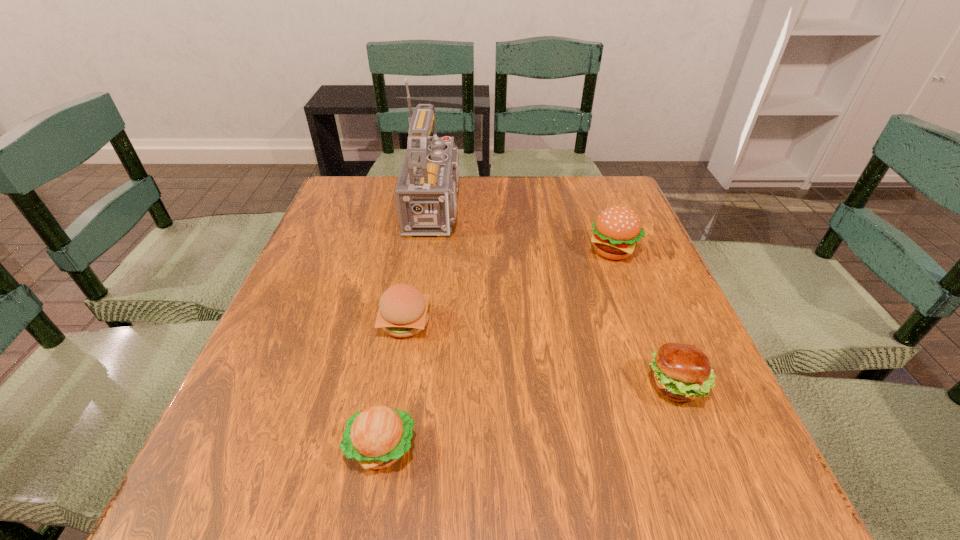
Identify the location of object that is the fourth closest one to the tallest object. (376, 437).

Find the location of a particular element. hamburger that stands as the fourth closest to the tallest object is located at coordinates (376, 437).

Where is `the second closest hamburger to the nearest hamburger`? the second closest hamburger to the nearest hamburger is located at coordinates (680, 372).

What are the coordinates of `free space in the image that satisfies the following two spatial constraints: 1. on the front-facing side of the third farthest hamburger; 2. on the right side of the tallest object` in the screenshot? It's located at (420, 386).